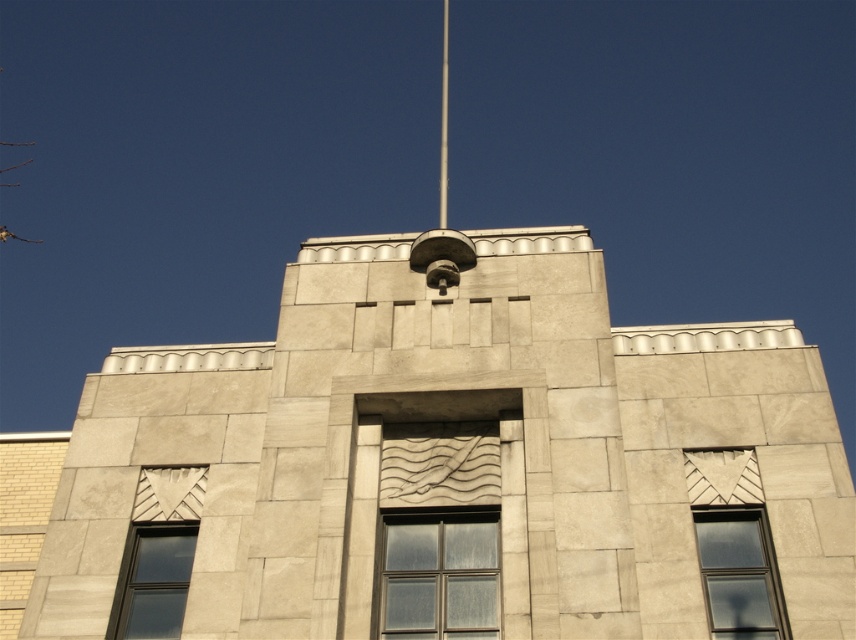
Question: Is beige stone tower at center to the right of clear glass window at center from the viewer's perspective?

Choices:
 (A) yes
 (B) no

Answer: (B)

Question: Does beige stone tower at center appear over clear glass window at center?

Choices:
 (A) no
 (B) yes

Answer: (B)

Question: Which of the following is the farthest from the observer?

Choices:
 (A) (411, 486)
 (B) (712, 630)

Answer: (A)

Question: Among these points, which one is nearest to the camera?

Choices:
 (A) (137, 540)
 (B) (712, 636)
 (C) (102, 566)

Answer: (B)

Question: Does beige stone tower at center have a lesser width compared to clear glass window at center?

Choices:
 (A) yes
 (B) no

Answer: (B)

Question: Based on their relative distances, which object is nearer to the clear glass window at center?

Choices:
 (A) matte glass window at lower left
 (B) matte glass window at lower right
 (C) beige stone tower at center

Answer: (C)